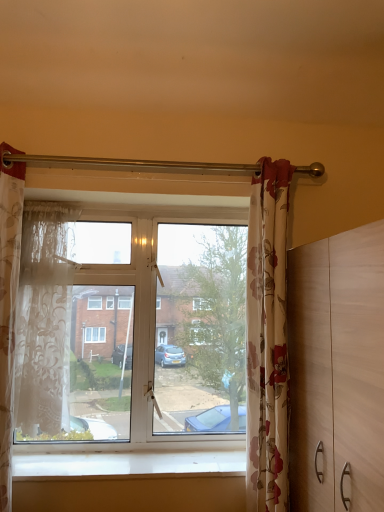
Question: Which is correct: floral fabric curtain at right, which is counted as the first curtain, starting from the right, is inside light brown wooden dresser at right, or outside of it?

Choices:
 (A) outside
 (B) inside

Answer: (A)

Question: Considering the positions of floral fabric curtain at right, which is counted as the first curtain, starting from the right, and light brown wooden dresser at right in the image, is floral fabric curtain at right, which is counted as the first curtain, starting from the right, wider or thinner than light brown wooden dresser at right?

Choices:
 (A) thin
 (B) wide

Answer: (A)

Question: Considering the real-world distances, which object is closest to the transparent glass window at center?

Choices:
 (A) translucent floral fabric curtain at left, the first curtain from the left
 (B) sheer white lace curtain at left, the 2th curtain from the right
 (C) floral fabric curtain at right, which is counted as the first curtain, starting from the right
 (D) white smooth window sill at lower center
 (E) light brown wooden dresser at right

Answer: (B)

Question: Estimate the real-world distances between objects in this image. Which object is closer to the white smooth window sill at lower center?

Choices:
 (A) sheer white lace curtain at left, the second curtain when ordered from left to right
 (B) floral fabric curtain at right, which is counted as the first curtain, starting from the right
 (C) light brown wooden dresser at right
 (D) transparent glass window at center
 (E) translucent floral fabric curtain at left, the first curtain from the left

Answer: (D)